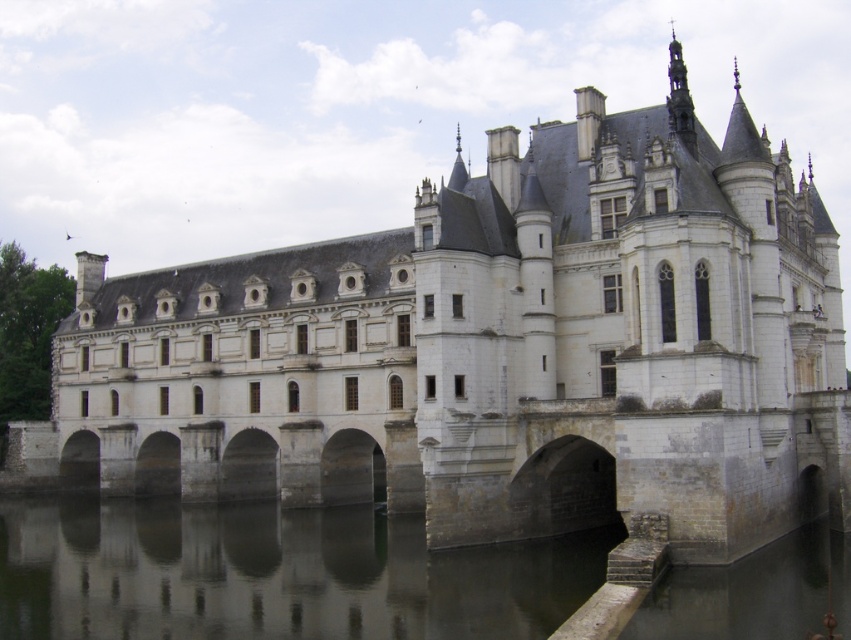
Looking at this image, you are a tourist visiting the castle and want to cross from the left side to the right side of the image. The stone arch bridge at center is the only path available. However, you notice that the smooth gray water at lower center is wider than the bridge. Does this mean the bridge is wide enough for you to cross safely?

The smooth gray water at lower center is wider than the stone arch bridge at center, but this does not indicate the bridge width. The bridge must be wide enough to cross safely as it is the only path provided.

You are standing at point (273, 573) in the castle scene. What do you see directly in front of you?

You see smooth gray water at lower center directly in front of you at point (273, 573).

You are a tourist standing on the stone arch bridge at center and want to take a photo of the castle reflected in the smooth gray water at lower center. Which direction should you face to capture the reflection?

You should face to the right side of the stone arch bridge at center because the smooth gray water at lower center is positioned on the right side of the stone arch bridge at center, allowing you to capture the reflection there.